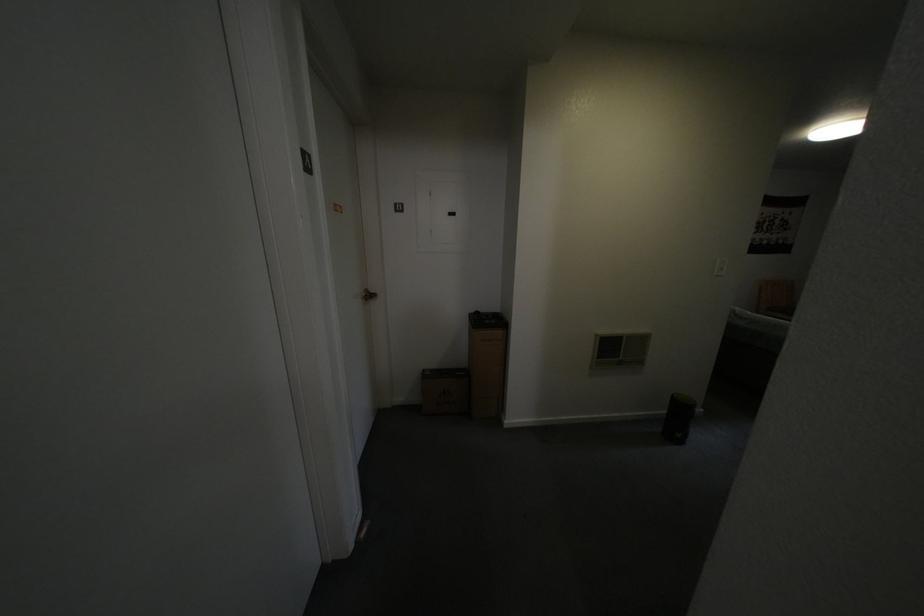
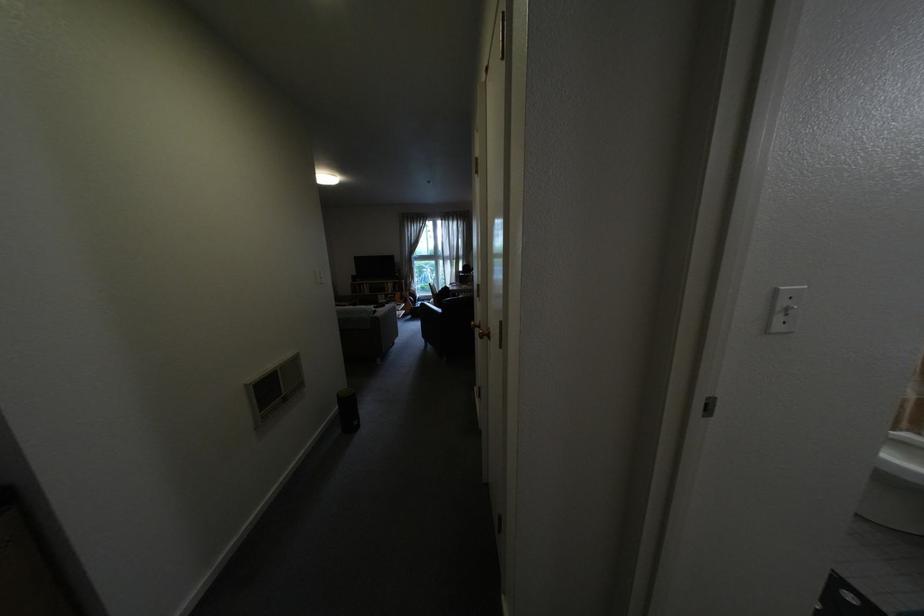
Question: The camera is either moving clockwise (left) or counter-clockwise (right) around the object. The first image is from the beginning of the video and the second image is from the end. Is the camera moving left or right when shooting the video?

Choices:
 (A) Left
 (B) Right

Answer: (A)